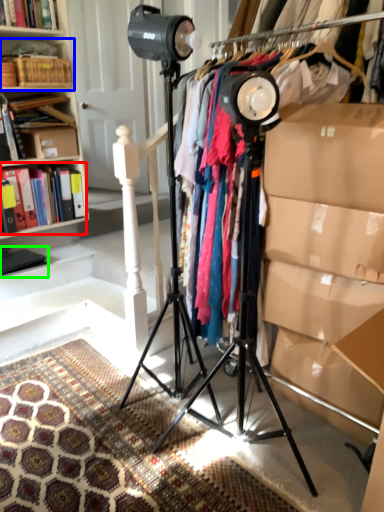
Question: Based on their relative distances, which object is farther from book (highlighted by a red box)? Choose from shelf (highlighted by a blue box) and book (highlighted by a green box).

Choices:
 (A) shelf
 (B) book

Answer: (A)